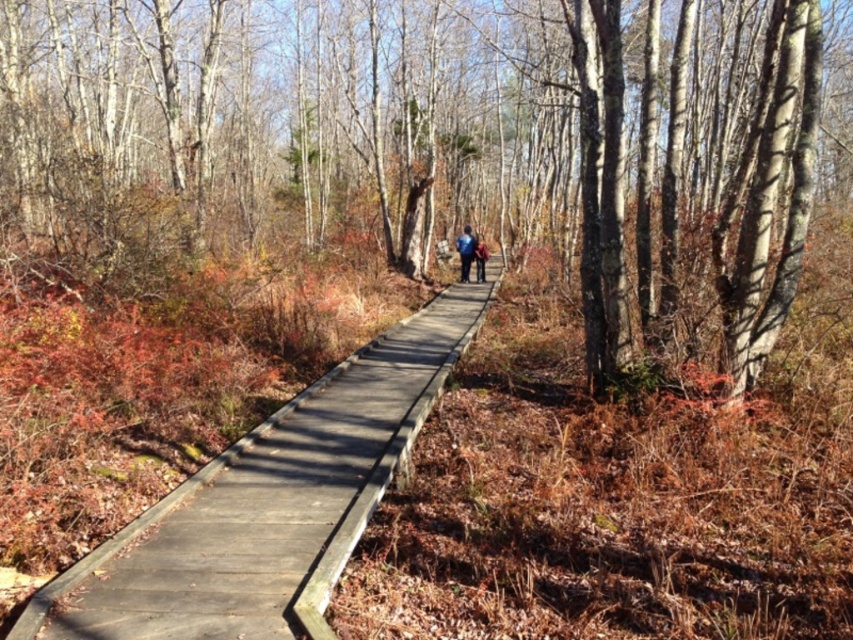
Question: Does smooth bark tree at center appear on the left side of dark blue jacket at center?

Choices:
 (A) yes
 (B) no

Answer: (A)

Question: Which object is positioned closest to the dark blue jacket at center?

Choices:
 (A) blue fabric jacket at center
 (B) wooden boardwalk at center
 (C) smooth bark tree at center

Answer: (A)

Question: Does blue fabric jacket at center lie behind dark blue jacket at center?

Choices:
 (A) no
 (B) yes

Answer: (A)

Question: Can you confirm if wooden boardwalk at center is wider than dark blue jacket at center?

Choices:
 (A) yes
 (B) no

Answer: (A)

Question: Estimate the real-world distances between objects in this image. Which object is farther from the wooden boardwalk at center?

Choices:
 (A) dark blue jacket at center
 (B) blue fabric jacket at center
 (C) smooth bark tree at center

Answer: (A)

Question: Based on their relative distances, which object is farther from the dark blue jacket at center?

Choices:
 (A) wooden boardwalk at center
 (B) blue fabric jacket at center

Answer: (A)